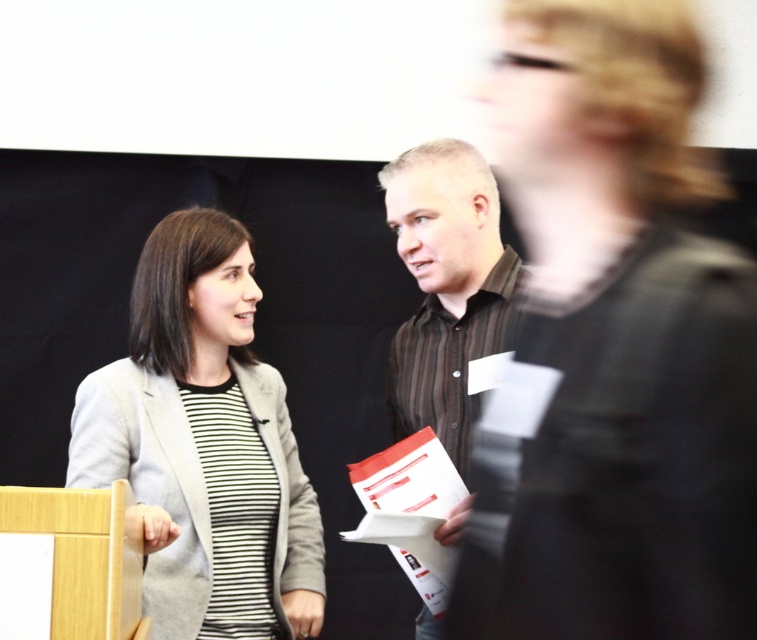
The width and height of the screenshot is (757, 640). What are the coordinates of `matte gray blazer at center` in the screenshot? It's located at (204, 444).

Is matte gray blazer at center below brown striped shirt at center?

Yes.

Who is more distant from viewer, (x=256, y=552) or (x=424, y=211)?

Positioned behind is point (x=424, y=211).

The height and width of the screenshot is (640, 757). What are the coordinates of `matte gray blazer at center` in the screenshot? It's located at (204, 444).